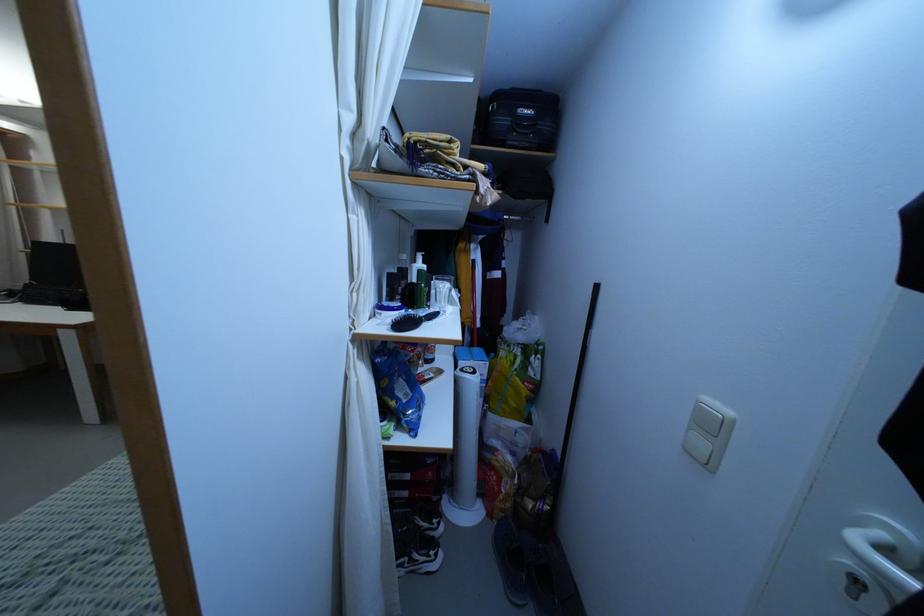
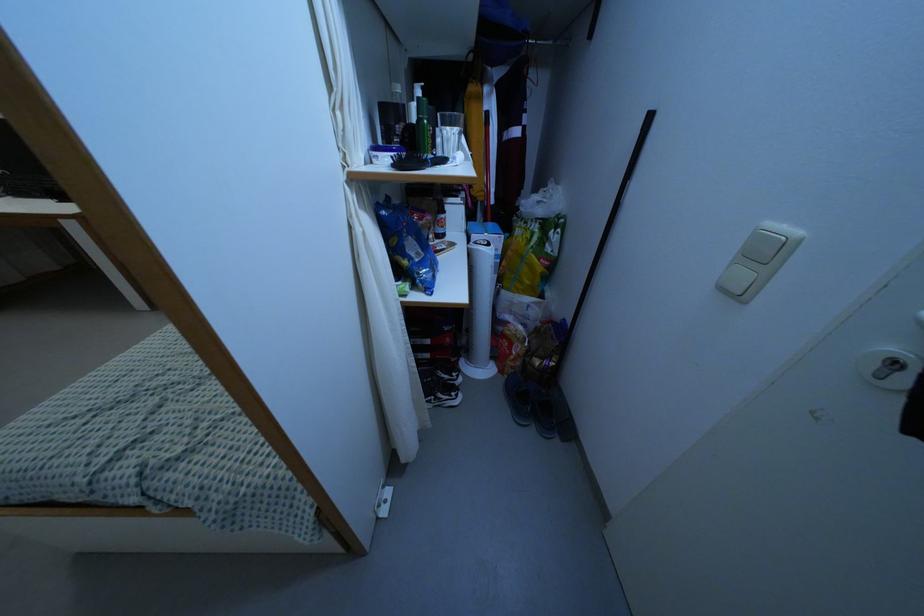
The point at (419, 270) is marked in the first image. Where is the corresponding point in the second image?

(418, 98)